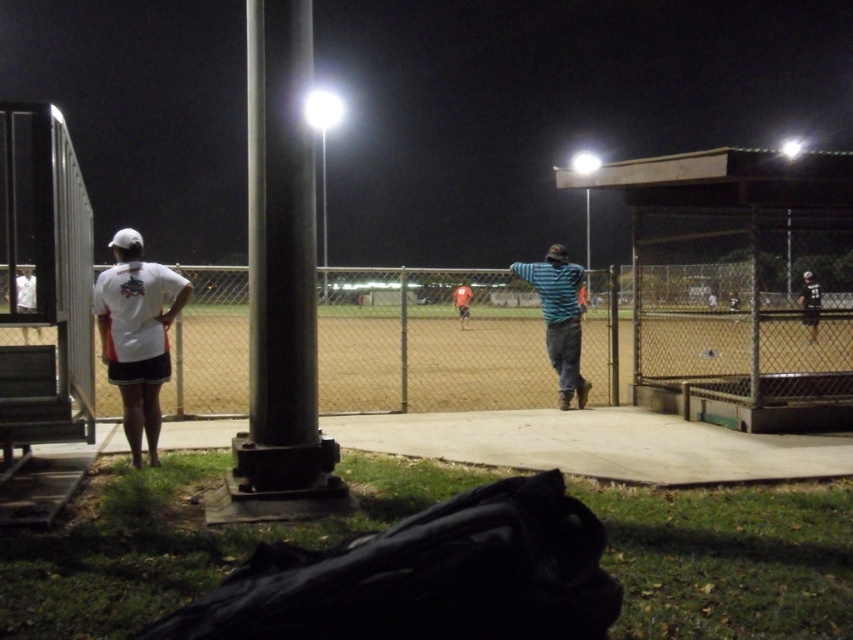
Question: Among these points, which one is nearest to the camera?

Choices:
 (A) (462, 296)
 (B) (561, 310)
 (C) (128, 301)

Answer: (C)

Question: Can you confirm if black metallic pole at center is bigger than red fabric shirt at center?

Choices:
 (A) yes
 (B) no

Answer: (B)

Question: Does striped cotton shirt at center appear on the right side of red fabric shirt at center?

Choices:
 (A) yes
 (B) no

Answer: (A)

Question: Can you confirm if black metallic pole at center is positioned above striped cotton shirt at center?

Choices:
 (A) yes
 (B) no

Answer: (A)

Question: Which object is positioned farthest from the striped cotton shirt at center?

Choices:
 (A) black metallic pole at center
 (B) dark blue jersey at right

Answer: (A)

Question: Estimate the real-world distances between objects in this image. Which object is farther from the red fabric shirt at center?

Choices:
 (A) white matte shirt at left
 (B) dark blue jersey at right

Answer: (A)